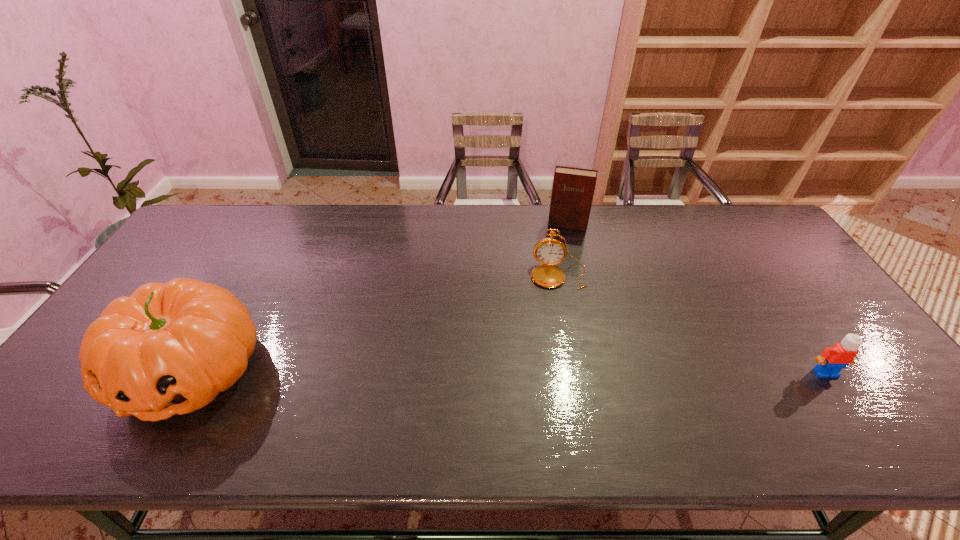
You are a GUI agent. You are given a task and a screenshot of the screen. Output one action in this format:
    pyautogui.click(x=<x>, y=<y>)
    Task: Click on the vacant region at the near edge of the desktop
    The height and width of the screenshot is (540, 960).
    Given the screenshot: What is the action you would take?
    (x=724, y=402)

In order to click on free region at the near right corner of the desktop in this screenshot , I will do `click(868, 400)`.

Locate an element on the screen. The height and width of the screenshot is (540, 960). empty space between the second farthest object and the Lego is located at coordinates (692, 324).

The height and width of the screenshot is (540, 960). Find the location of `vacant region between the rightmost object and the second farthest object`. vacant region between the rightmost object and the second farthest object is located at coordinates (692, 324).

In order to click on vacant space that is in between the leftmost object and the pocket watch in this screenshot , I will do `click(375, 323)`.

In order to click on free space between the pocket watch and the leftmost object in this screenshot , I will do `click(375, 323)`.

The width and height of the screenshot is (960, 540). In order to click on free spot between the Lego and the diary in this screenshot , I will do `click(697, 299)`.

Locate an element on the screen. free area in between the pumpkin and the rightmost object is located at coordinates 509,372.

Identify the location of empty location between the farthest object and the rightmost object. (697, 299).

I want to click on free space between the leftmost object and the Lego, so click(x=509, y=372).